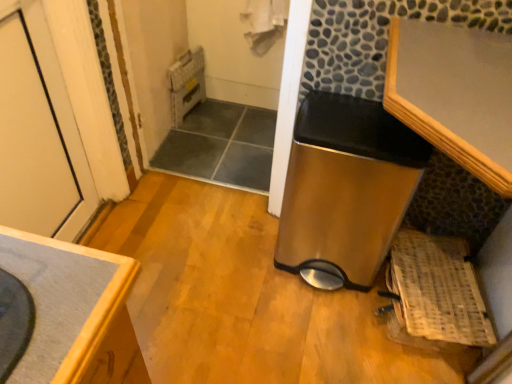
Question: Is stainless steel trash can at center, positioned as the 2th water heater in back-to-front order, positioned behind woven wood basket at lower right?

Choices:
 (A) no
 (B) yes

Answer: (A)

Question: Considering the relative sizes of stainless steel trash can at center, arranged as the 2th water heater when viewed from the top, and woven wood basket at lower right in the image provided, is stainless steel trash can at center, arranged as the 2th water heater when viewed from the top, thinner than woven wood basket at lower right?

Choices:
 (A) no
 (B) yes

Answer: (B)

Question: Can you confirm if stainless steel trash can at center, the 1th water heater positioned from the right, is bigger than woven wood basket at lower right?

Choices:
 (A) yes
 (B) no

Answer: (A)

Question: Is stainless steel trash can at center, which ranks as the 1th water heater in bottom-to-top order, wider than woven wood basket at lower right?

Choices:
 (A) yes
 (B) no

Answer: (B)

Question: Is stainless steel trash can at center, which ranks as the 1th water heater in bottom-to-top order, to the left of woven wood basket at lower right from the viewer's perspective?

Choices:
 (A) no
 (B) yes

Answer: (B)

Question: From a real-world perspective, is woven wood basket at lower right physically located above or below stainless steel trash can at center, the 1th water heater in the front-to-back sequence?

Choices:
 (A) below
 (B) above

Answer: (A)

Question: Looking at their shapes, would you say woven wood basket at lower right is wider or thinner than stainless steel trash can at center, the 1th water heater in the front-to-back sequence?

Choices:
 (A) thin
 (B) wide

Answer: (B)

Question: From their relative heights in the image, would you say woven wood basket at lower right is taller or shorter than stainless steel trash can at center, the 1th water heater positioned from the right?

Choices:
 (A) tall
 (B) short

Answer: (B)

Question: Considering the positions of point (449, 322) and point (364, 105), is point (449, 322) closer or farther from the camera than point (364, 105)?

Choices:
 (A) closer
 (B) farther

Answer: (B)

Question: Is stainless steel trash can at center, the 1th water heater positioned from the right, inside or outside of wooden countertop at lower left?

Choices:
 (A) inside
 (B) outside

Answer: (B)

Question: In the image, is stainless steel trash can at center, arranged as the 2th water heater when viewed from the left, on the left side or the right side of wooden countertop at lower left?

Choices:
 (A) right
 (B) left

Answer: (A)

Question: In terms of width, does stainless steel trash can at center, the 1th water heater in the front-to-back sequence, look wider or thinner when compared to wooden countertop at lower left?

Choices:
 (A) thin
 (B) wide

Answer: (B)

Question: Relative to wooden countertop at lower left, is stainless steel trash can at center, the 1th water heater in the front-to-back sequence, in front or behind?

Choices:
 (A) behind
 (B) front

Answer: (A)

Question: Considering the positions of metallic gray water heater at upper center, the first water heater viewed from the back, and wooden countertop at lower left in the image, is metallic gray water heater at upper center, the first water heater viewed from the back, wider or thinner than wooden countertop at lower left?

Choices:
 (A) wide
 (B) thin

Answer: (B)

Question: Considering the positions of metallic gray water heater at upper center, the first water heater viewed from the back, and wooden countertop at lower left in the image, is metallic gray water heater at upper center, the first water heater viewed from the back, taller or shorter than wooden countertop at lower left?

Choices:
 (A) short
 (B) tall

Answer: (A)